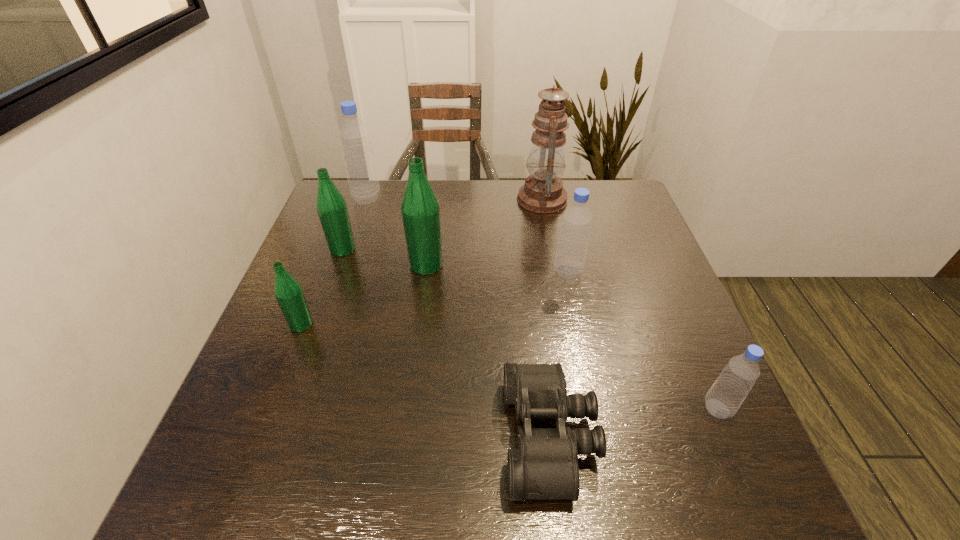
In the image, there is a desktop. At what (x,y) coordinates should I click in order to perform the action: click on free space at the left edge. Please return your answer as a coordinate pair (x, y). Image resolution: width=960 pixels, height=540 pixels. Looking at the image, I should click on (355, 259).

Find the location of a particular element. The image size is (960, 540). vacant space at the right edge of the desktop is located at coordinates (607, 269).

Where is `vacant space at the far left corner of the desktop`? vacant space at the far left corner of the desktop is located at coordinates (349, 210).

I want to click on vacant space at the far right corner of the desktop, so click(610, 202).

At what (x,y) coordinates should I click in order to perform the action: click on unoccupied area between the second nearest bottle and the second biggest green bottle. Please return your answer as a coordinate pair (x, y). The height and width of the screenshot is (540, 960). Looking at the image, I should click on (322, 287).

I want to click on free space between the second biggest green bottle and the fifth object from right to left, so click(x=385, y=257).

You are a GUI agent. You are given a task and a screenshot of the screen. Output one action in this format:
    pyautogui.click(x=<x>, y=<y>)
    Task: Click on the vacant space in between the second biggest green bottle and the fourth object from left to right
    
    Given the screenshot: What is the action you would take?
    pyautogui.click(x=385, y=257)

Locate an element on the screen. The width and height of the screenshot is (960, 540). free space between the second nearest blue bottle and the fifth object from right to left is located at coordinates (497, 268).

Find the location of a particular element. This screenshot has height=540, width=960. empty space that is in between the shortest object and the smallest green bottle is located at coordinates (425, 380).

Locate an element on the screen. The height and width of the screenshot is (540, 960). empty space that is in between the leftmost blue bottle and the second farthest blue bottle is located at coordinates (468, 235).